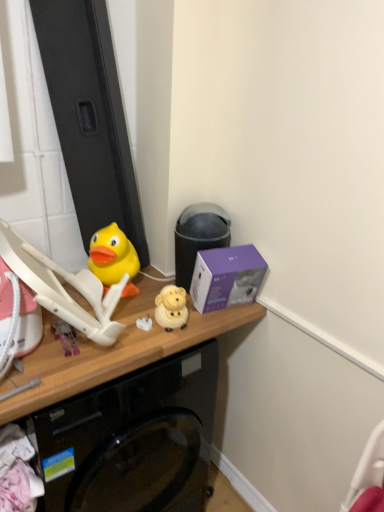
You are a GUI agent. You are given a task and a screenshot of the screen. Output one action in this format:
    pyautogui.click(x=<x>, y=<y>)
    Task: Click on the free space in front of pink plastic toy at lower left, the 1th toy viewed from the left
    
    Given the screenshot: What is the action you would take?
    pyautogui.click(x=52, y=368)